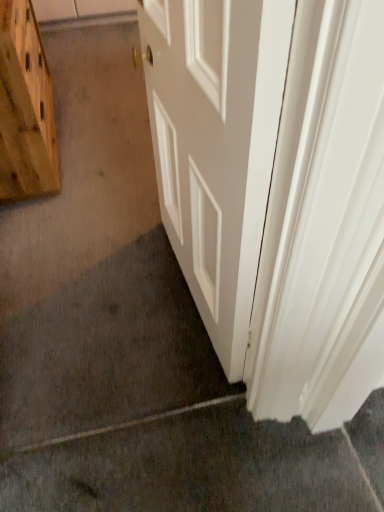
Question: Is white smooth door at center smaller than wooden cutting board at left?

Choices:
 (A) no
 (B) yes

Answer: (B)

Question: From a real-world perspective, is white smooth door at center below wooden cutting board at left?

Choices:
 (A) no
 (B) yes

Answer: (A)

Question: From a real-world perspective, is white smooth door at center physically above wooden cutting board at left?

Choices:
 (A) no
 (B) yes

Answer: (B)

Question: Considering the relative positions of white smooth door at center and wooden cutting board at left in the image provided, is white smooth door at center to the left of wooden cutting board at left from the viewer's perspective?

Choices:
 (A) yes
 (B) no

Answer: (B)

Question: Does white smooth door at center have a larger size compared to wooden cutting board at left?

Choices:
 (A) yes
 (B) no

Answer: (B)

Question: Is white smooth door at center completely or partially outside of wooden cutting board at left?

Choices:
 (A) no
 (B) yes

Answer: (B)

Question: Does wooden cutting board at left have a greater width compared to gray carpet at lower left?

Choices:
 (A) no
 (B) yes

Answer: (A)

Question: Can you confirm if wooden cutting board at left is positioned to the right of gray carpet at lower left?

Choices:
 (A) no
 (B) yes

Answer: (A)

Question: Can you confirm if wooden cutting board at left is taller than gray carpet at lower left?

Choices:
 (A) no
 (B) yes

Answer: (B)

Question: Is wooden cutting board at left not within gray carpet at lower left?

Choices:
 (A) no
 (B) yes

Answer: (B)

Question: From a real-world perspective, is wooden cutting board at left below gray carpet at lower left?

Choices:
 (A) yes
 (B) no

Answer: (B)

Question: From the image's perspective, is wooden cutting board at left on top of gray carpet at lower left?

Choices:
 (A) yes
 (B) no

Answer: (A)

Question: Is gray carpet at lower left turned away from white smooth door at center?

Choices:
 (A) no
 (B) yes

Answer: (A)